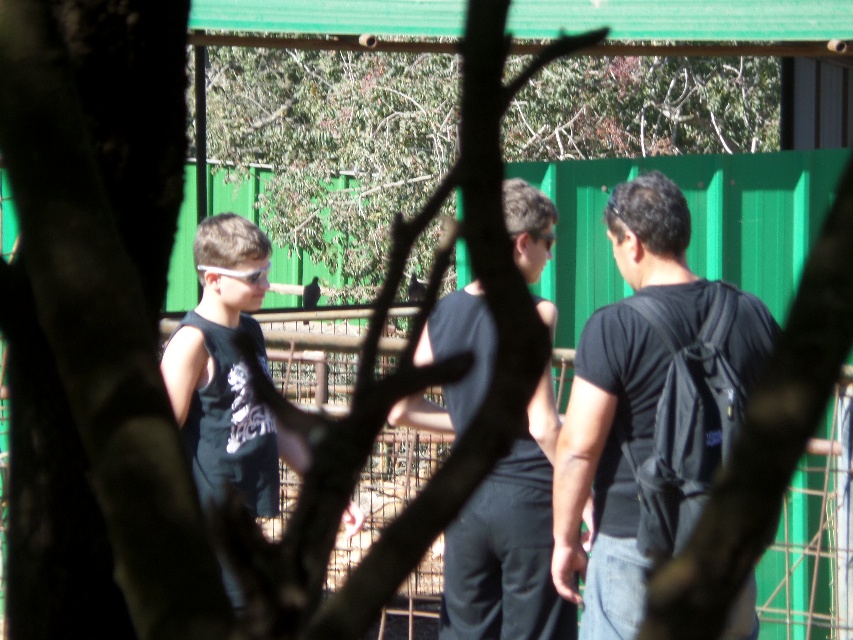
Question: Based on their relative distances, which object is farther from the black matte tank top at left?

Choices:
 (A) black matte tank top at center
 (B) black matte backpack at right

Answer: (B)

Question: Which of the following is the closest to the observer?

Choices:
 (A) black matte tank top at left
 (B) black matte tank top at center

Answer: (B)

Question: Is black matte tank top at center thinner than black matte tank top at left?

Choices:
 (A) no
 (B) yes

Answer: (B)

Question: Is black matte tank top at center bigger than black matte tank top at left?

Choices:
 (A) no
 (B) yes

Answer: (B)

Question: Can you confirm if black matte tank top at center is positioned to the right of black matte tank top at left?

Choices:
 (A) no
 (B) yes

Answer: (B)

Question: Among these objects, which one is farthest from the camera?

Choices:
 (A) black matte backpack at right
 (B) black matte tank top at center

Answer: (A)